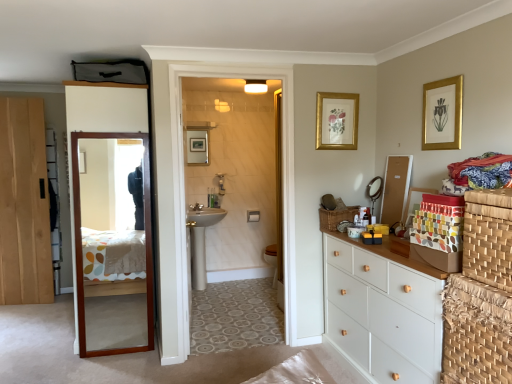
Find the location of a particular element. The height and width of the screenshot is (384, 512). free space to the right of natural wood door at left, marked as the 1th door in a left-to-right arrangement is located at coordinates (55, 310).